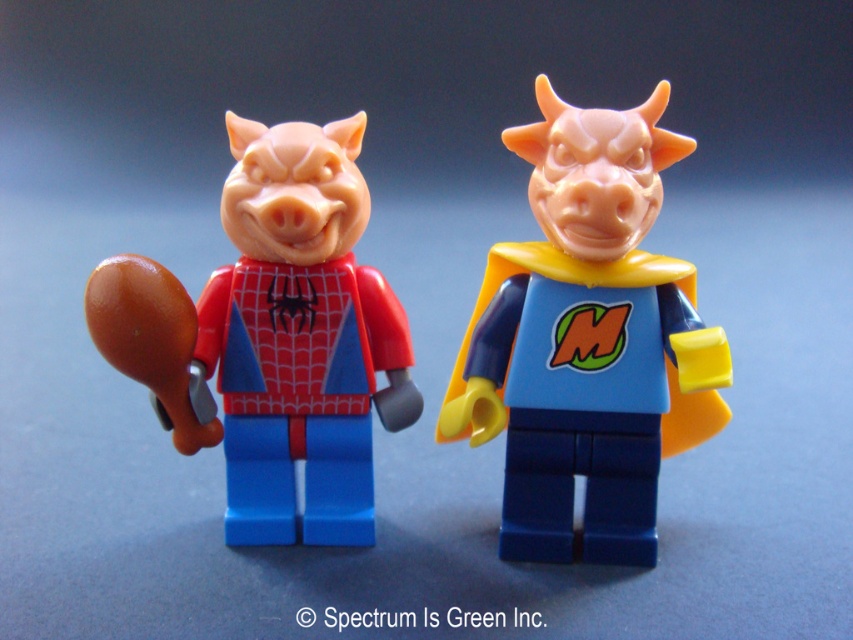
You are a photographer trying to capture both LEGO minifigures in a single shot. You notice two specific points in the image marked as point 1 at coordinates point (x=590, y=150) and point 2 at coordinates point (x=190, y=442). Which point should you focus on to ensure both minifigures are in sharp focus?

Point 1 at coordinates point (x=590, y=150) is in front of point 2 at coordinates point (x=190, y=442), so focusing on point 1 will ensure both minifigures are in sharp focus since it is closer to the camera.

You are a toy collector who wants to display the matte plastic minifigure at right and the matte plastic pig at center on a shelf. If the shelf has a height limit of 15 cm, and the pig is 10 cm tall, will both fit without exceeding the limit?

The matte plastic minifigure at right is taller than the matte plastic pig at center. Since the pig is 10 cm tall and the shelf has a 15 cm height limit, the minifigure must be less than or equal to 15 cm. However, since it is taller than the pig, its height is more than 10 cm. Therefore, both will fit as long as the minifigure is under 15 cm, but we cannot confirm without exact measurements. However, based on the description, the minifigure is taller than the pig but may still be within the limit.

You are a photographer holding a camera 1.05 meters away from the matte plastic minifigure at right. Can you capture both LEGO minifigures in a single photo without moving the camera or the figures?

The matte plastic minifigure at right and camera are 1.05 meters apart, so if the camera is positioned to include both figures, the distance allows capturing both in one shot since the figures are side by side.